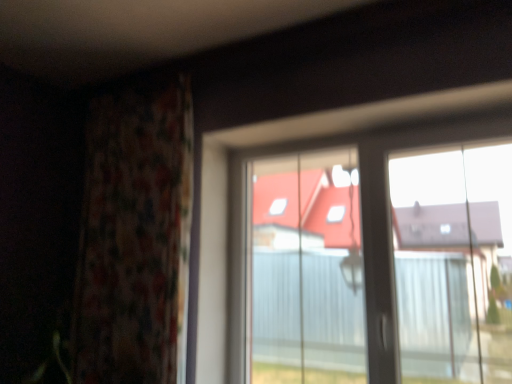
Question: Visually, is transparent plastic window at center positioned to the left or to the right of floral fabric curtain at left?

Choices:
 (A) right
 (B) left

Answer: (A)

Question: Is transparent plastic window at center in front of or behind floral fabric curtain at left in the image?

Choices:
 (A) behind
 (B) front

Answer: (B)

Question: Is transparent plastic window at center situated inside floral fabric curtain at left or outside?

Choices:
 (A) inside
 (B) outside

Answer: (B)

Question: Which is correct: floral fabric curtain at left is inside transparent plastic window at center, or outside of it?

Choices:
 (A) inside
 (B) outside

Answer: (B)

Question: Is floral fabric curtain at left wider or thinner than transparent plastic window at center?

Choices:
 (A) thin
 (B) wide

Answer: (B)

Question: Is floral fabric curtain at left bigger or smaller than transparent plastic window at center?

Choices:
 (A) small
 (B) big

Answer: (B)

Question: From their relative heights in the image, would you say floral fabric curtain at left is taller or shorter than transparent plastic window at center?

Choices:
 (A) short
 (B) tall

Answer: (B)